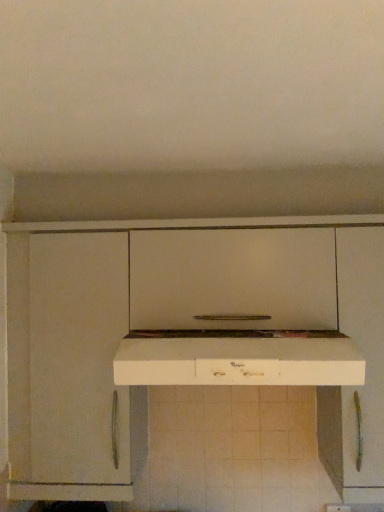
You are a GUI agent. You are given a task and a screenshot of the screen. Output one action in this format:
    pyautogui.click(x=<x>, y=<y>)
    Task: Click on the free point above white matte countertop at center (from a real-world perspective)
    
    Given the screenshot: What is the action you would take?
    pyautogui.click(x=211, y=336)